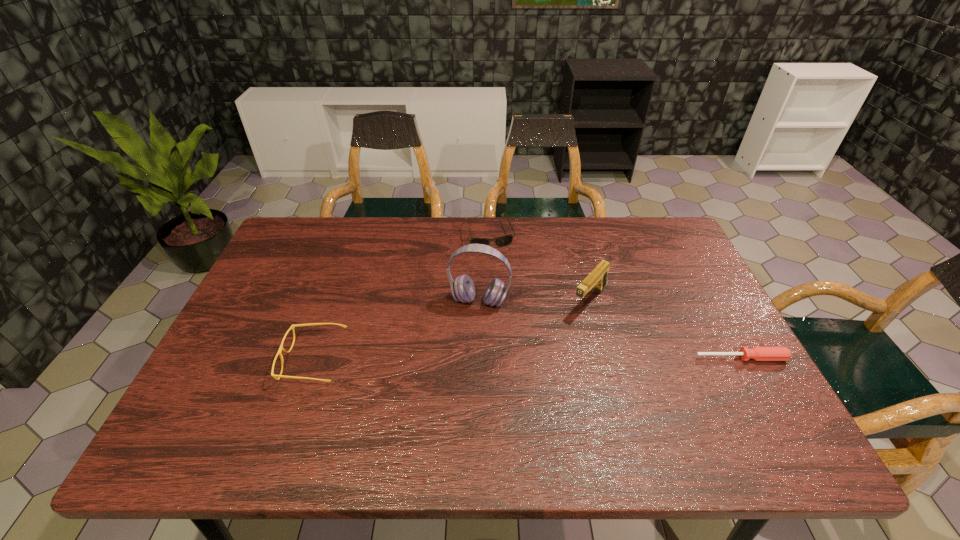
In order to click on object that stands as the third closest to the farthest object in this screenshot , I will do `click(281, 348)`.